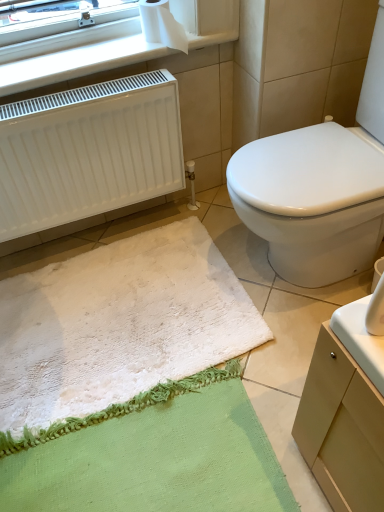
What is the approximate height of white paper at upper left?

12.32 centimeters.

In order to click on white glossy toilet at center in this screenshot , I will do `click(311, 204)`.

This screenshot has width=384, height=512. Describe the element at coordinates (311, 204) in the screenshot. I see `white glossy toilet at center` at that location.

Locate an element on the screen. The width and height of the screenshot is (384, 512). white fluffy bath mat at lower left is located at coordinates (118, 332).

From the image's perspective, is white paper at upper left below white glossy toilet at center?

Actually, white paper at upper left appears above white glossy toilet at center in the image.

From a real-world perspective, who is located lower, white paper at upper left or white glossy toilet at center?

From a 3D spatial view, white glossy toilet at center is below.

Which is more to the right, white paper at upper left or white glossy toilet at center?

white glossy toilet at center.

Can you tell me how much white paper at upper left and white glossy toilet at center differ in facing direction?

The angular difference between white paper at upper left and white glossy toilet at center is 87.1 degrees.

In the image, is white paper at upper left on the left side or the right side of white matte radiator at left?

Clearly, white paper at upper left is on the right of white matte radiator at left in the image.

Considering the sizes of objects white paper at upper left and white matte radiator at left in the image provided, who is smaller, white paper at upper left or white matte radiator at left?

Smaller between the two is white paper at upper left.

From the picture: Which is nearer, (x=183, y=31) or (x=97, y=193)?

Point (x=183, y=31)

Considering the sizes of objects white glossy toilet at center and white matte radiator at left in the image provided, who is thinner, white glossy toilet at center or white matte radiator at left?

Thinner between the two is white matte radiator at left.

Which is behind, point (307, 170) or point (10, 175)?

The point (10, 175) is behind.

From the image's perspective, which object appears higher, white glossy toilet at center or white matte radiator at left?

white matte radiator at left.

Does white paper at upper left have a larger size compared to white fluffy bath mat at lower left?

Incorrect, white paper at upper left is not larger than white fluffy bath mat at lower left.

Is white fluffy bath mat at lower left at the back of white paper at upper left?

No, white paper at upper left is not facing the opposite direction of white fluffy bath mat at lower left.

In terms of width, does white paper at upper left look wider or thinner when compared to white fluffy bath mat at lower left?

Considering their sizes, white paper at upper left looks slimmer than white fluffy bath mat at lower left.

Measure the distance between white paper at upper left and white fluffy bath mat at lower left.

They are 34.93 inches apart.

Identify the location of bath mat located on the right of white matte radiator at left. (118, 332).

Considering the positions of objects white fluffy bath mat at lower left and white matte radiator at left in the image provided, who is more to the left, white fluffy bath mat at lower left or white matte radiator at left?

Positioned to the left is white matte radiator at left.

From the image's perspective, is white fluffy bath mat at lower left below white matte radiator at left?

Yes, from the image's perspective, white fluffy bath mat at lower left is below white matte radiator at left.

Is white matte radiator at left to the left or to the right of white plastic radiator at upper left in the image?

white matte radiator at left is to the left of white plastic radiator at upper left.

Is white matte radiator at left inside or outside of white plastic radiator at upper left?

white matte radiator at left is spatially situated outside white plastic radiator at upper left.

Who is taller, white matte radiator at left or white plastic radiator at upper left?

With more height is white matte radiator at left.

From the image's perspective, between white matte radiator at left and white plastic radiator at upper left, who is located below?

white matte radiator at left, from the image's perspective.

Is white plastic radiator at upper left at the left side of white paper at upper left?

Yes.

Is white plastic radiator at upper left looking in the opposite direction of white paper at upper left?

No, white plastic radiator at upper left's orientation is not away from white paper at upper left.

Based on the photo, which is behind, white plastic radiator at upper left or white paper at upper left?

Positioned behind is white paper at upper left.

Looking at this image, is white paper at upper left completely or partially inside white plastic radiator at upper left?

No, white paper at upper left is not inside white plastic radiator at upper left.

At what (x,y) coordinates should I click in order to perform the action: click on toilet that appears below the white paper at upper left (from a real-world perspective). Please return your answer as a coordinate pair (x, y). The image size is (384, 512). Looking at the image, I should click on (311, 204).

You are a GUI agent. You are given a task and a screenshot of the screen. Output one action in this format:
    pyautogui.click(x=<x>, y=<y>)
    Task: Click on the toilet paper on the right of white matte radiator at left
    This screenshot has width=384, height=512.
    Given the screenshot: What is the action you would take?
    pyautogui.click(x=162, y=25)

Estimate the real-world distances between objects in this image. Which object is further from white matte radiator at left, white fluffy bath mat at lower left or white paper at upper left?

white fluffy bath mat at lower left is further to white matte radiator at left.

From the image, which object appears to be nearer to white plastic radiator at upper left, white fluffy bath mat at lower left or white paper at upper left?

Based on the image, white paper at upper left appears to be nearer to white plastic radiator at upper left.

From the image, which object appears to be nearer to white plastic radiator at upper left, white glossy toilet at center or white paper at upper left?

Among the two, white paper at upper left is located nearer to white plastic radiator at upper left.

When comparing their distances from white matte radiator at left, does white paper at upper left or white plastic radiator at upper left seem closer?

white plastic radiator at upper left lies closer to white matte radiator at left than the other object.

Looking at the image, which one is located further to white matte radiator at left, white plastic radiator at upper left or white glossy toilet at center?

Based on the image, white glossy toilet at center appears to be further to white matte radiator at left.

When comparing their distances from white matte radiator at left, does white paper at upper left or white glossy toilet at center seem closer?

white paper at upper left is positioned closer to the anchor white matte radiator at left.

Looking at the image, which one is located closer to white paper at upper left, white fluffy bath mat at lower left or white matte radiator at left?

white matte radiator at left is closer to white paper at upper left.

Which object lies nearer to the anchor point white plastic radiator at upper left, white paper at upper left or white glossy toilet at center?

white paper at upper left.

At what (x,y) coordinates should I click in order to perform the action: click on toilet paper between white matte radiator at left and white glossy toilet at center from left to right. Please return your answer as a coordinate pair (x, y). Looking at the image, I should click on (162, 25).

Where is `bath mat located between white matte radiator at left and white glossy toilet at center in the left-right direction`? bath mat located between white matte radiator at left and white glossy toilet at center in the left-right direction is located at coordinates (118, 332).

Identify the location of toilet between white plastic radiator at upper left and white fluffy bath mat at lower left from top to bottom. (311, 204).

You are a GUI agent. You are given a task and a screenshot of the screen. Output one action in this format:
    pyautogui.click(x=<x>, y=<y>)
    Task: Click on the radiator between white plastic radiator at upper left and white fluffy bath mat at lower left in the vertical direction
    The image size is (384, 512).
    Given the screenshot: What is the action you would take?
    pyautogui.click(x=88, y=152)